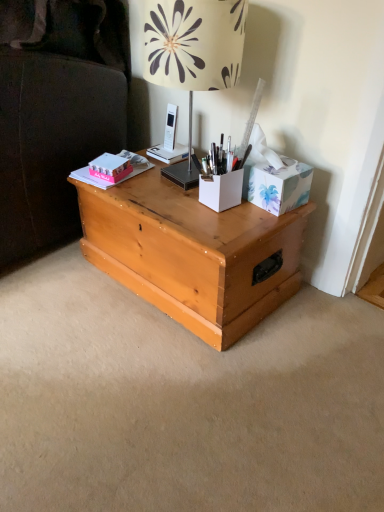
Question: Is pink matte book at upper left not close to pink matte box at upper left?

Choices:
 (A) no
 (B) yes

Answer: (A)

Question: Considering the relative sizes of pink matte book at upper left and pink matte box at upper left in the image provided, is pink matte book at upper left wider than pink matte box at upper left?

Choices:
 (A) no
 (B) yes

Answer: (B)

Question: Considering the relative sizes of pink matte book at upper left and pink matte box at upper left in the image provided, is pink matte book at upper left bigger than pink matte box at upper left?

Choices:
 (A) no
 (B) yes

Answer: (B)

Question: From a real-world perspective, is pink matte book at upper left over pink matte box at upper left?

Choices:
 (A) no
 (B) yes

Answer: (A)

Question: Does pink matte book at upper left appear on the left side of pink matte box at upper left?

Choices:
 (A) yes
 (B) no

Answer: (A)

Question: Would you say beige floral lampshade at upper center is to the left or to the right of white matte pen holder at center, the first cardboard box in the left-to-right sequence, in the picture?

Choices:
 (A) left
 (B) right

Answer: (A)

Question: Is beige floral lampshade at upper center situated inside white matte pen holder at center, the first cardboard box in the left-to-right sequence, or outside?

Choices:
 (A) outside
 (B) inside

Answer: (A)

Question: Is beige floral lampshade at upper center wider or thinner than white matte pen holder at center, the first cardboard box in the left-to-right sequence?

Choices:
 (A) thin
 (B) wide

Answer: (B)

Question: From the image's perspective, is beige floral lampshade at upper center located above or below white matte pen holder at center, marked as the 2th cardboard box in a right-to-left arrangement?

Choices:
 (A) above
 (B) below

Answer: (A)

Question: Is point (160, 81) positioned closer to the camera than point (137, 170)?

Choices:
 (A) farther
 (B) closer

Answer: (B)

Question: From a real-world perspective, is beige floral lampshade at upper center physically located above or below pink matte book at upper left?

Choices:
 (A) below
 (B) above

Answer: (B)

Question: Is beige floral lampshade at upper center inside the boundaries of pink matte book at upper left, or outside?

Choices:
 (A) outside
 (B) inside

Answer: (A)

Question: Considering their positions, is beige floral lampshade at upper center located in front of or behind pink matte book at upper left?

Choices:
 (A) front
 (B) behind

Answer: (A)

Question: In terms of width, does light wood trunk at center look wider or thinner when compared to beige floral lampshade at upper center?

Choices:
 (A) wide
 (B) thin

Answer: (A)

Question: Visually, is light wood trunk at center positioned to the left or to the right of beige floral lampshade at upper center?

Choices:
 (A) right
 (B) left

Answer: (B)